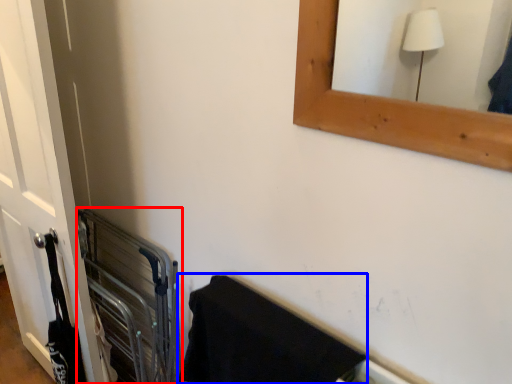
Question: Among these objects, which one is nearest to the camera, balustrade (highlighted by a red box) or bath towel (highlighted by a blue box)?

Choices:
 (A) balustrade
 (B) bath towel

Answer: (B)